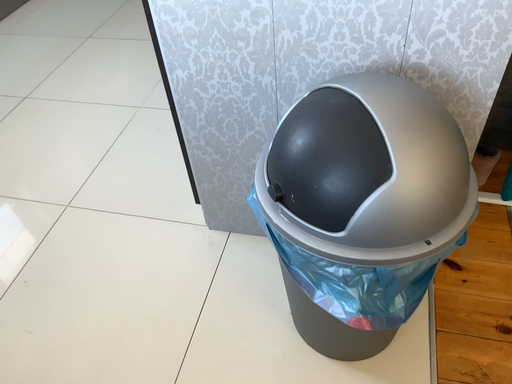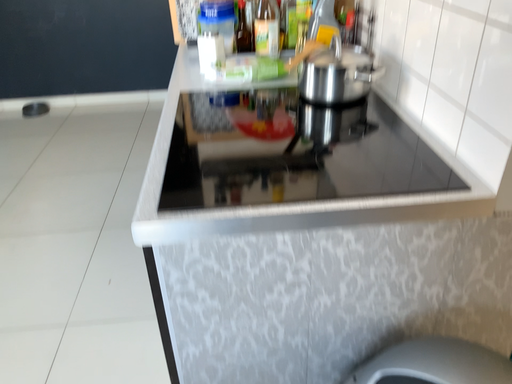
Question: Which way did the camera rotate in the video?

Choices:
 (A) rotated right
 (B) rotated left

Answer: (A)